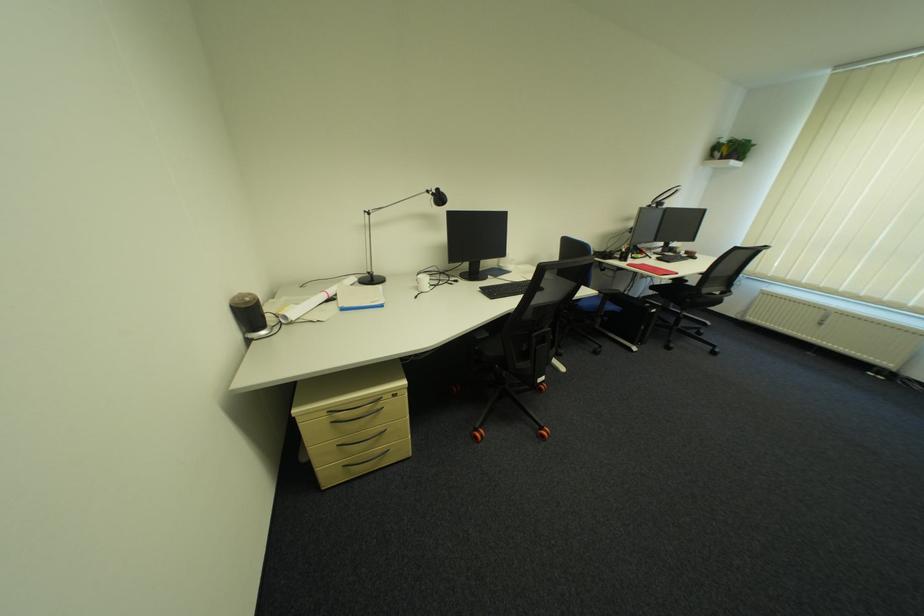
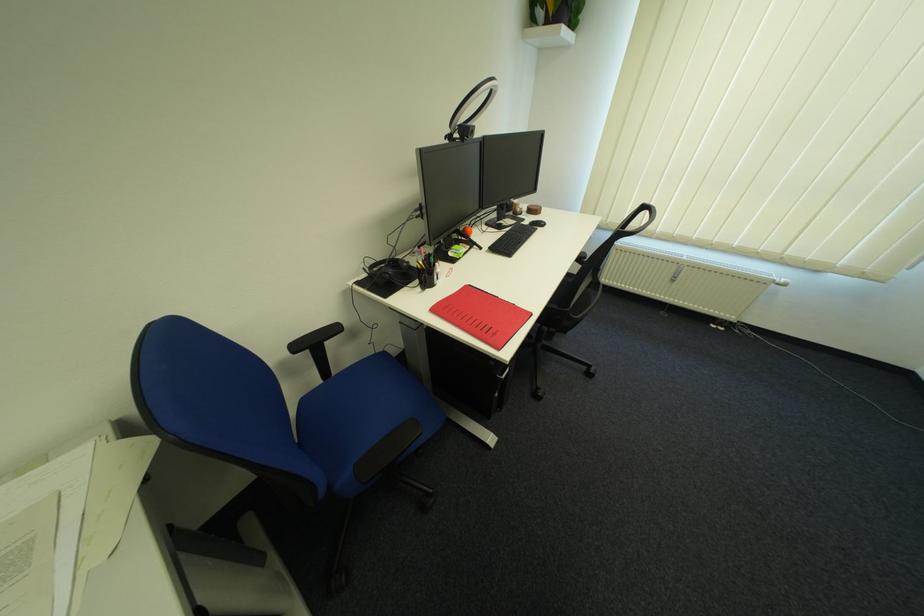
Locate, in the second image, the point that corresponds to pixel 664 206 in the first image.

(467, 136)